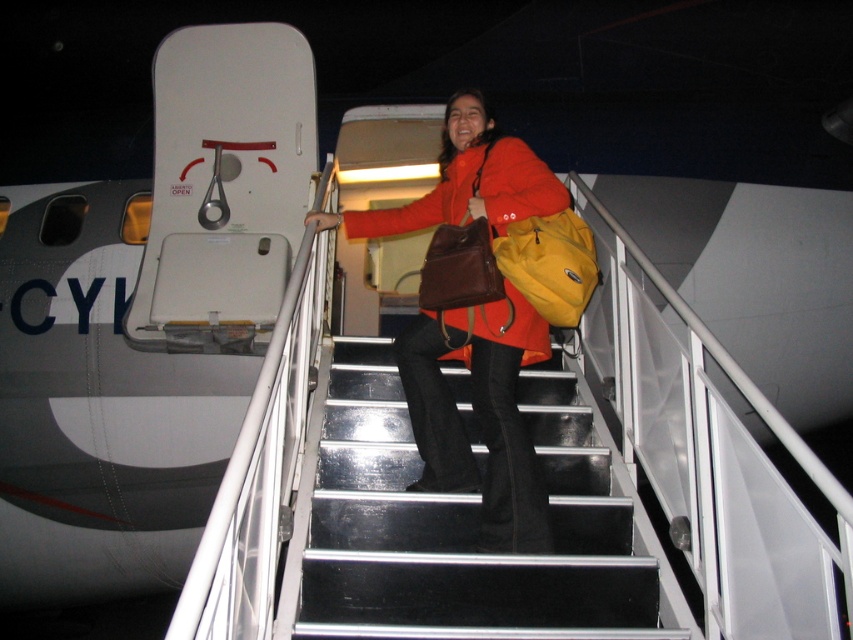
Does metallic silver stairs at center have a larger size compared to yellow fabric backpack at center?

Yes.

Does metallic silver stairs at center lie behind yellow fabric backpack at center?

No, metallic silver stairs at center is closer to the viewer.

Which is behind, point (469, 609) or point (512, 241)?

Point (512, 241)

Where is `metallic silver stairs at center`? The width and height of the screenshot is (853, 640). metallic silver stairs at center is located at coordinates (463, 525).

Between point (486, 200) and point (392, 224), which one is positioned in front?

Positioned in front is point (486, 200).

Is matte orange coat at center above matte orange jacket at center?

Incorrect, matte orange coat at center is not positioned above matte orange jacket at center.

The width and height of the screenshot is (853, 640). What do you see at coordinates (479, 413) in the screenshot?
I see `matte orange coat at center` at bounding box center [479, 413].

Locate an element on the screen. This screenshot has width=853, height=640. matte orange coat at center is located at coordinates [x=479, y=413].

Who is more forward, (x=409, y=509) or (x=502, y=195)?

Point (x=409, y=509)

Can you confirm if metallic silver stairs at center is positioned to the right of matte orange coat at center?

Yes, metallic silver stairs at center is to the right of matte orange coat at center.

Image resolution: width=853 pixels, height=640 pixels. What do you see at coordinates (463, 525) in the screenshot?
I see `metallic silver stairs at center` at bounding box center [463, 525].

Image resolution: width=853 pixels, height=640 pixels. Find the location of `metallic silver stairs at center`. metallic silver stairs at center is located at coordinates (463, 525).